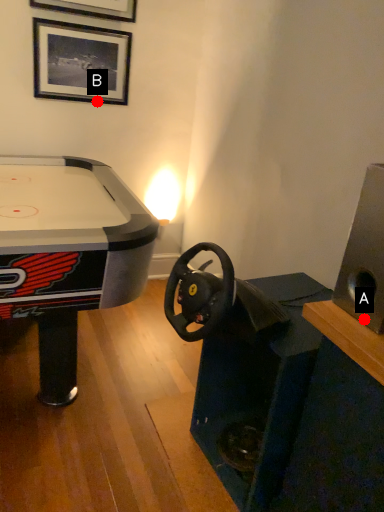
Question: Two points are circled on the image, labeled by A and B beside each circle. Which of the following is the farthest from the observer?

Choices:
 (A) A is further
 (B) B is further

Answer: (B)